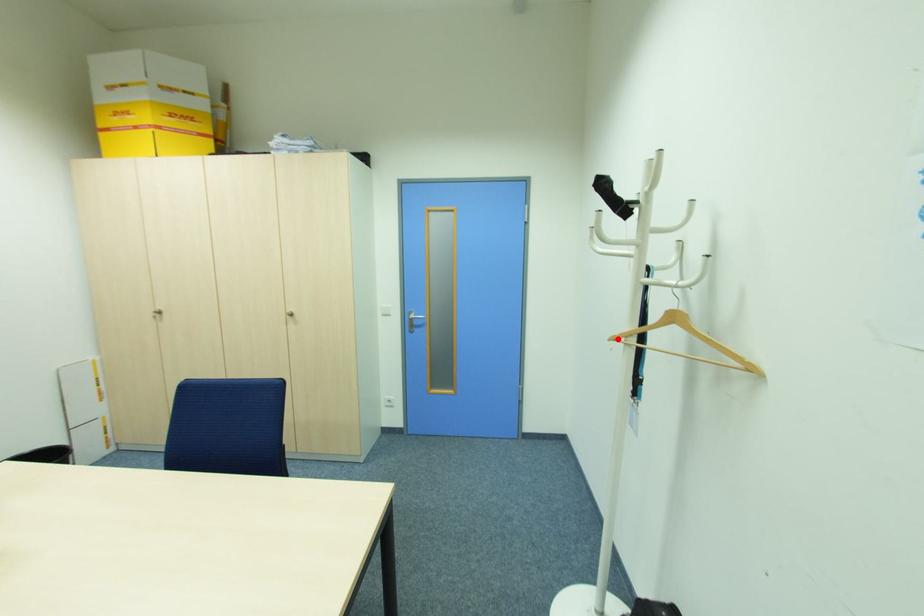
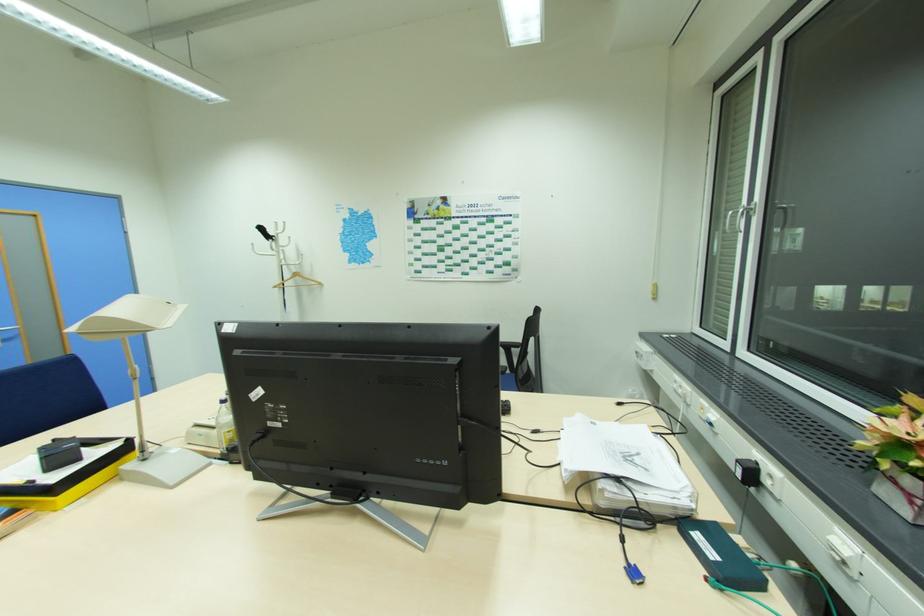
Question: I am providing you with two images of the same scene from different viewpoints. A red point is marked on the first image. Is the red point's position out of view in image 2?

Choices:
 (A) Yes
 (B) No

Answer: (B)